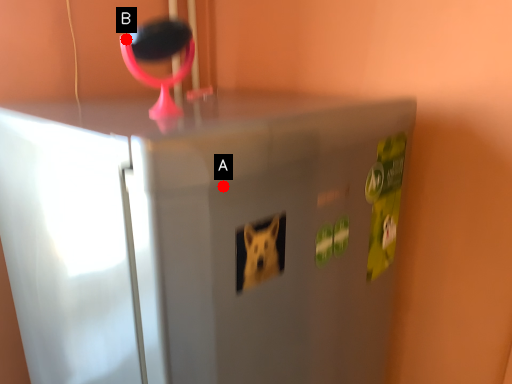
Question: Two points are circled on the image, labeled by A and B beside each circle. Which point is closer to the camera?

Choices:
 (A) A is closer
 (B) B is closer

Answer: (A)